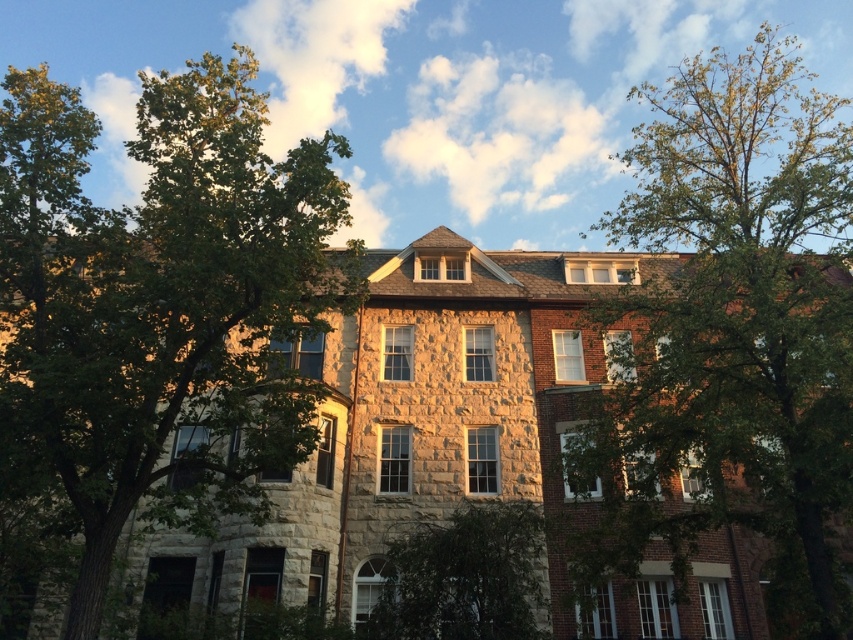
You are standing in front of the multi story building and want to take a photo of the entire structure without any obstructions. Which object at point (164,301) should you move to achieve this?

The green leafy tree at left located at point (164,301) is obstructing the view of the building, so moving it would allow you to take a clear photo of the entire structure without obstructions.

You are standing in front of the building and want to determine which tree is taller between the green leafy tree at right and the green leafy tree at center. Can you tell me which one is taller?

The green leafy tree at right is taller than the green leafy tree at center.